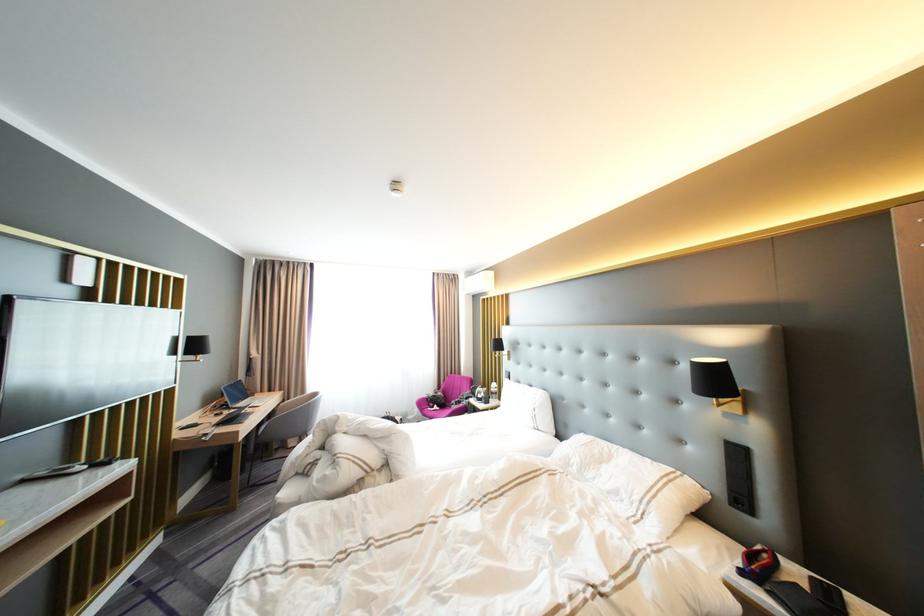
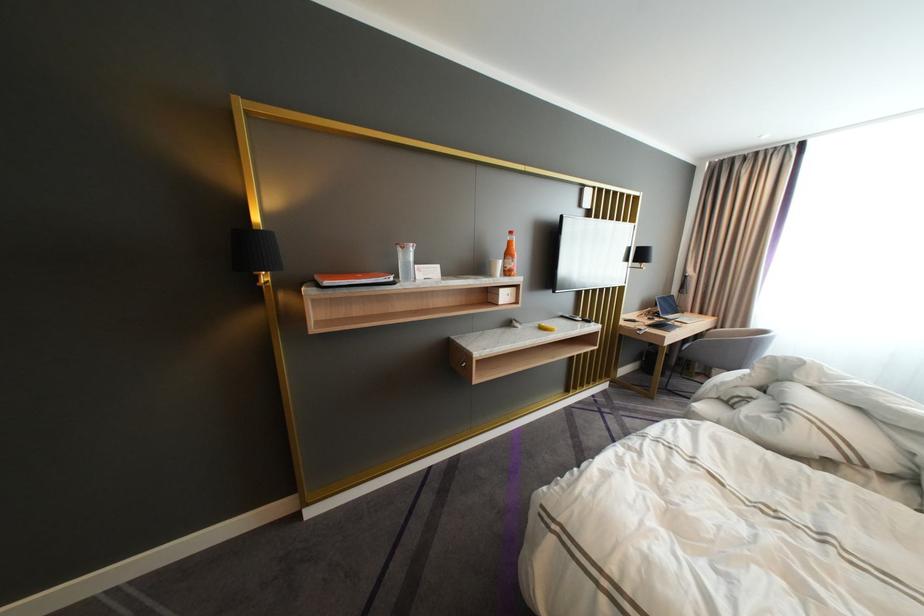
Question: The first image is from the beginning of the video and the second image is from the end. How did the camera likely rotate when shooting the video?

Choices:
 (A) Left
 (B) Right
 (C) Up
 (D) Down

Answer: (A)